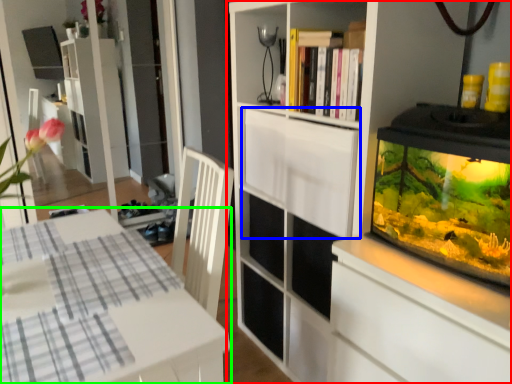
Question: Considering the real-world distances, which object is closest to cupboard (highlighted by a red box)? cabinetry (highlighted by a blue box) or table (highlighted by a green box).

Choices:
 (A) cabinetry
 (B) table

Answer: (A)